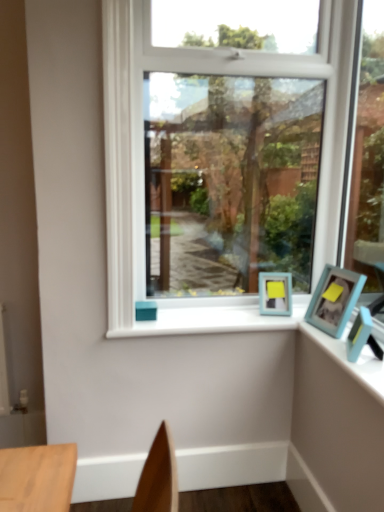
Question: Does white painted wood at center lie in front of blue plastic photo frame at upper right?

Choices:
 (A) no
 (B) yes

Answer: (A)

Question: Does white painted wood at center have a smaller size compared to blue plastic photo frame at upper right?

Choices:
 (A) no
 (B) yes

Answer: (A)

Question: From the image's perspective, is white painted wood at center on top of blue plastic photo frame at upper right?

Choices:
 (A) no
 (B) yes

Answer: (B)

Question: Are white painted wood at center and blue plastic photo frame at upper right making contact?

Choices:
 (A) no
 (B) yes

Answer: (A)

Question: Are white painted wood at center and blue plastic photo frame at upper right far apart?

Choices:
 (A) no
 (B) yes

Answer: (A)

Question: Would you say white painted wood at center is to the left or to the right of teal matte picture frame at right, the first picture frame viewed from the front, in the picture?

Choices:
 (A) right
 (B) left

Answer: (B)

Question: In terms of size, does white painted wood at center appear bigger or smaller than teal matte picture frame at right, which is the second picture frame in back-to-front order?

Choices:
 (A) small
 (B) big

Answer: (B)

Question: Considering the positions of white painted wood at center and teal matte picture frame at right, which is the second picture frame in back-to-front order, in the image, is white painted wood at center wider or thinner than teal matte picture frame at right, which is the second picture frame in back-to-front order,?

Choices:
 (A) wide
 (B) thin

Answer: (A)

Question: Is white painted wood at center in front of or behind teal matte picture frame at right, which is the second picture frame in back-to-front order, in the image?

Choices:
 (A) behind
 (B) front

Answer: (A)

Question: From a real-world perspective, is clear glass window at center positioned above or below teal matte picture frame at right, the first picture frame viewed from the front?

Choices:
 (A) below
 (B) above

Answer: (B)

Question: In terms of size, does clear glass window at center appear bigger or smaller than teal matte picture frame at right, which is the second picture frame in back-to-front order?

Choices:
 (A) big
 (B) small

Answer: (A)

Question: Considering their positions, is clear glass window at center located in front of or behind teal matte picture frame at right, which is the second picture frame in back-to-front order?

Choices:
 (A) front
 (B) behind

Answer: (B)

Question: Is clear glass window at center inside or outside of teal matte picture frame at right, which is the second picture frame in back-to-front order?

Choices:
 (A) outside
 (B) inside

Answer: (A)

Question: From a real-world perspective, is blue plastic photo frame at upper right physically located above or below white painted wood at center?

Choices:
 (A) above
 (B) below

Answer: (A)

Question: Is blue plastic photo frame at upper right spatially inside white painted wood at center, or outside of it?

Choices:
 (A) inside
 (B) outside

Answer: (B)